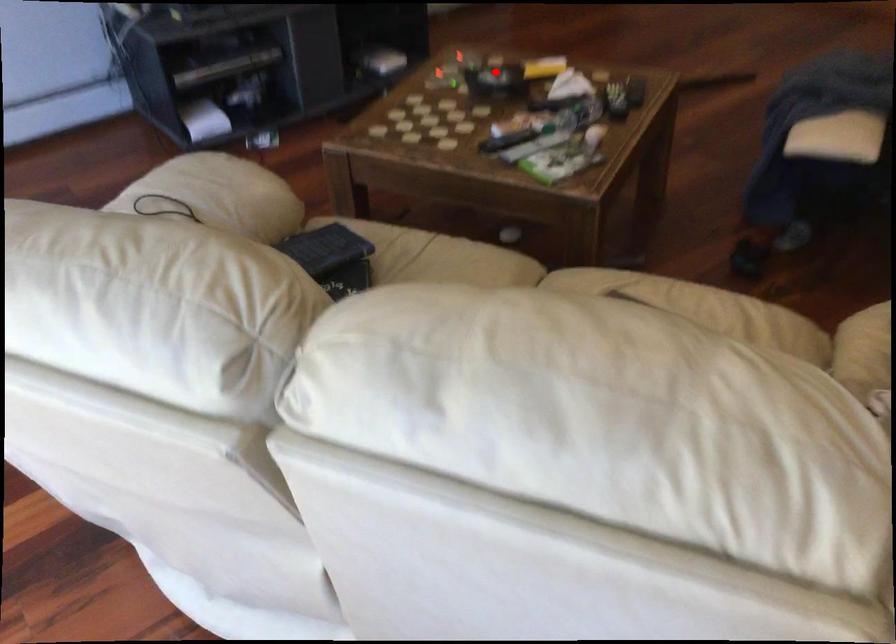
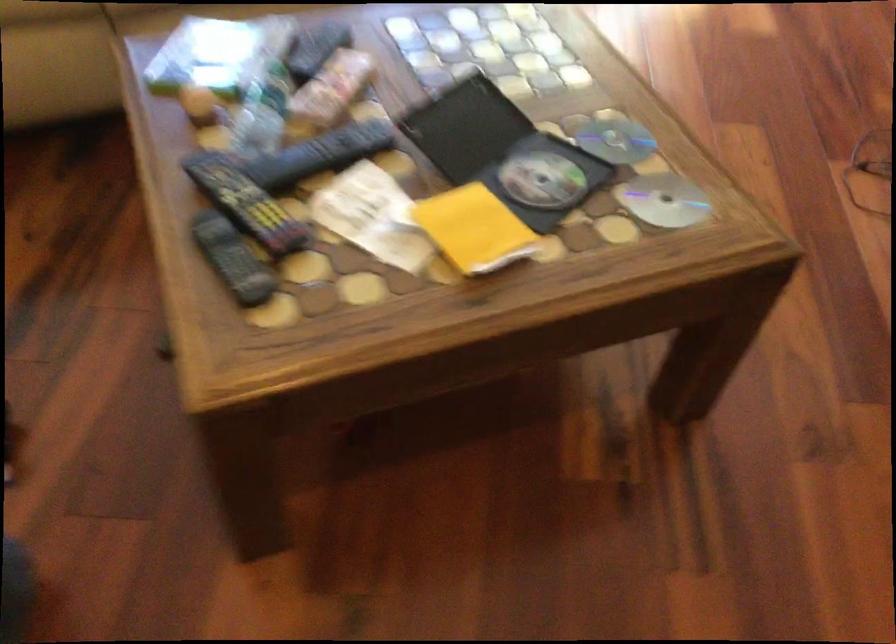
Question: I am providing you with two images of the same scene from different viewpoints. Image1 has a red point marked. In image2, the corresponding 3D location appears at what relative position? Reply with the corresponding letter.

Choices:
 (A) Closer
 (B) Farther

Answer: (A)